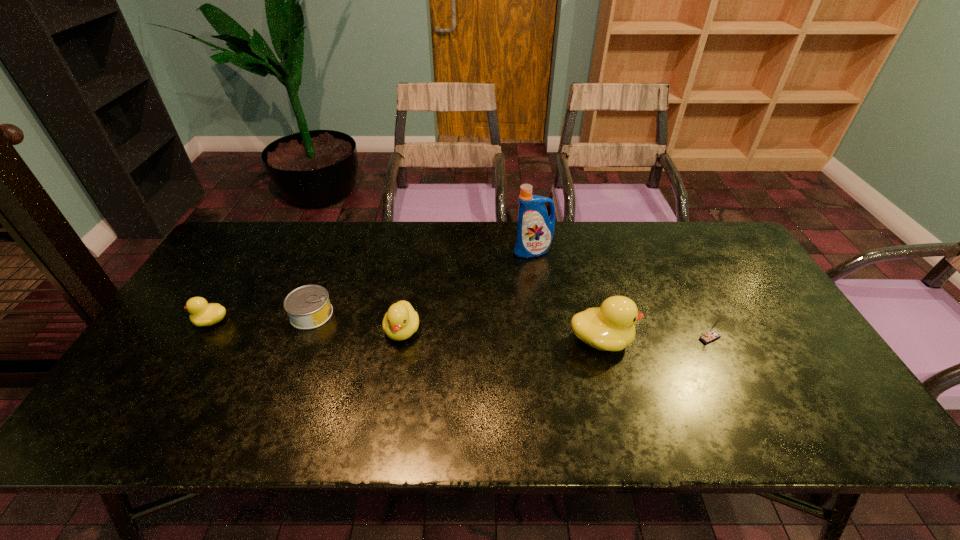
This screenshot has height=540, width=960. Find the location of `vacant place for an extra duckling on the right`. vacant place for an extra duckling on the right is located at coordinates (809, 350).